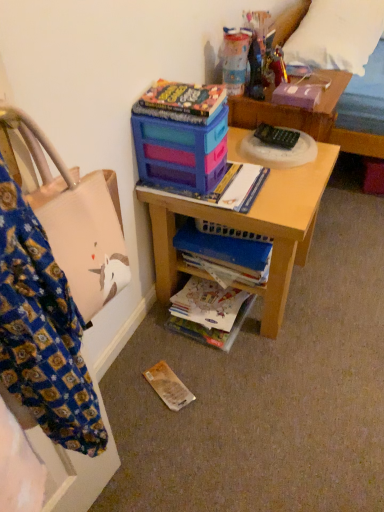
Image resolution: width=384 pixels, height=512 pixels. Identify the location of vacant space to the right of brown paper book at lower center, the first paperback book viewed from the left. (211, 384).